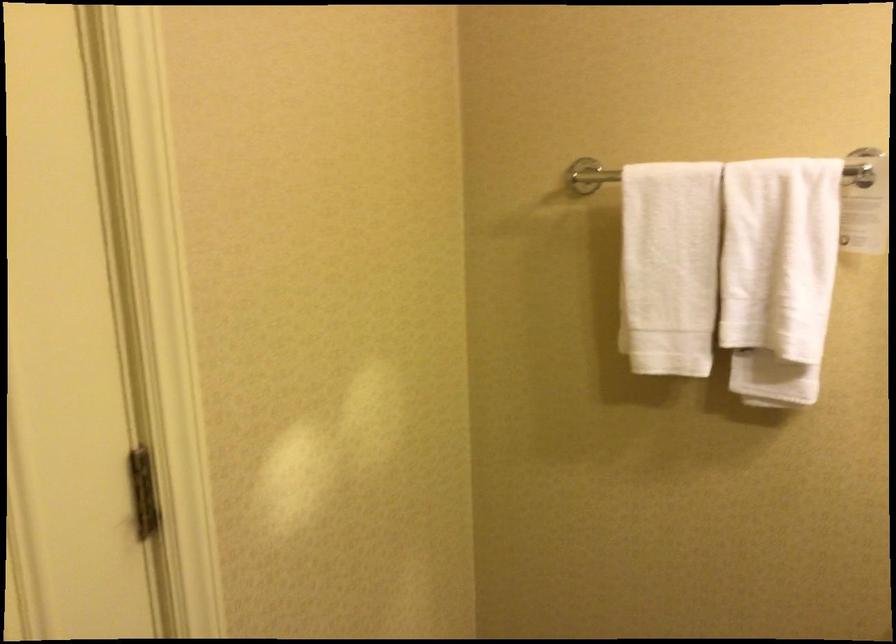
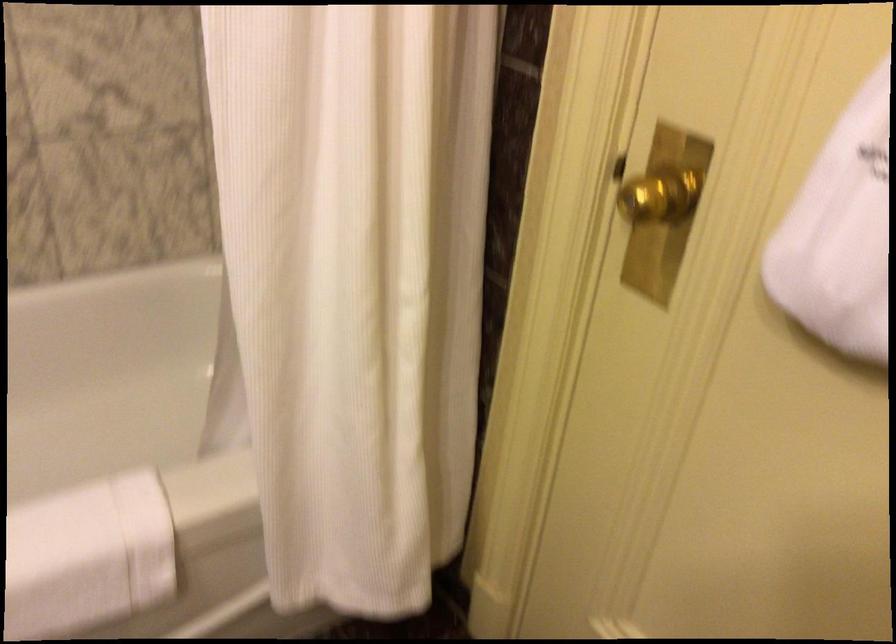
How did the camera likely rotate?

The rotation direction of the camera is left-down.